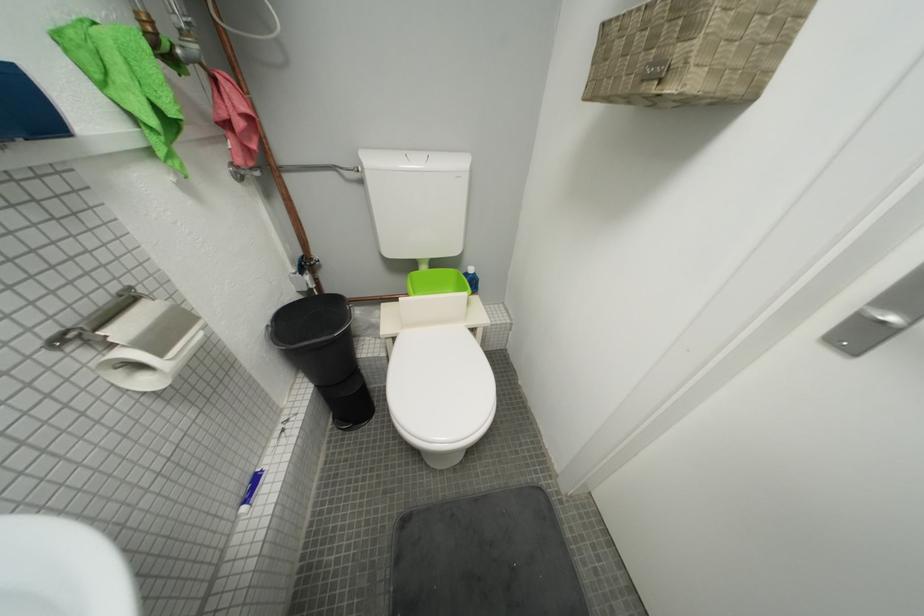
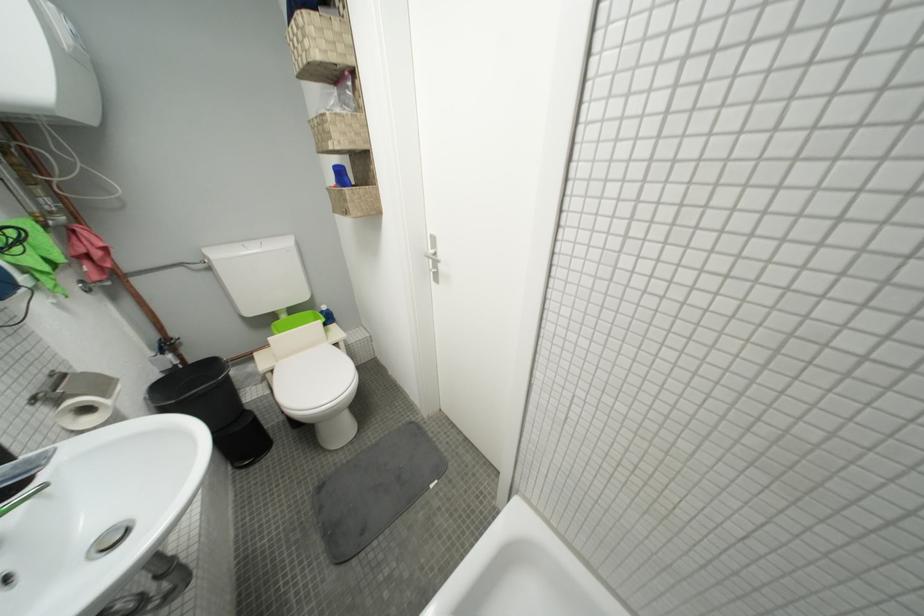
Where in the second image is the point corresponding to the point at 403,341 from the first image?

(281, 373)